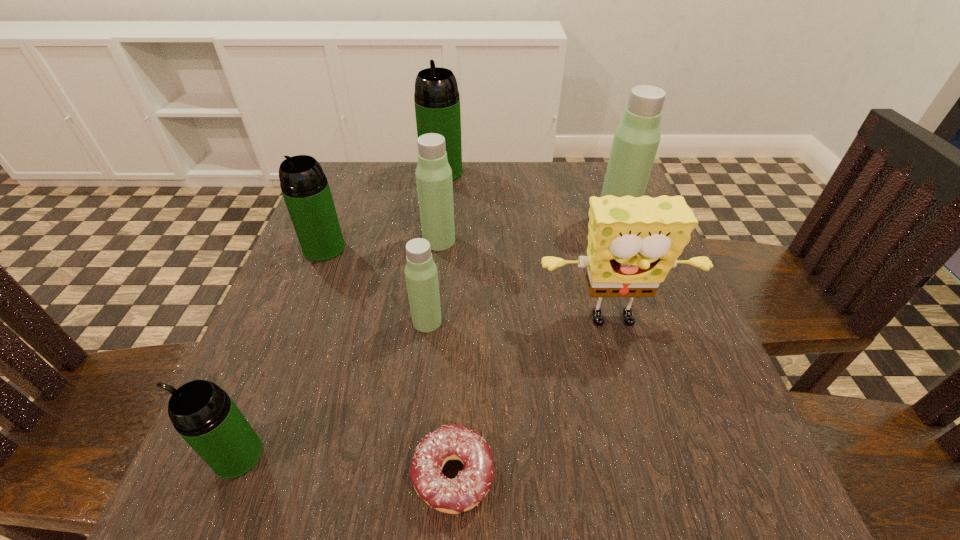
Locate which object is the seventh closest to the nearest green thermos bottle. Please provide its 2D coordinates. Your answer should be formatted as a tuple, i.e. [(x, y)], where the tuple contains the x and y coordinates of a point satisfying the conditions above.

[(637, 137)]

Where is `the fifth closest object to the smallest light thermos bottle`? the fifth closest object to the smallest light thermos bottle is located at coordinates (205, 416).

Find the location of `thermos bottle that is the closest to the second biggest light thermos bottle`. thermos bottle that is the closest to the second biggest light thermos bottle is located at coordinates (304, 186).

Identify which thermos bottle is located as the second nearest to the sponge. Please provide its 2D coordinates. Your answer should be formatted as a tuple, i.e. [(x, y)], where the tuple contains the x and y coordinates of a point satisfying the conditions above.

[(637, 137)]

Image resolution: width=960 pixels, height=540 pixels. What are the coordinates of `green thermos bottle object that ranks as the second closest to the farthest green thermos bottle` in the screenshot? It's located at (205, 416).

Locate which green thermos bottle ranks second in proximity to the nearest thermos bottle. Please provide its 2D coordinates. Your answer should be formatted as a tuple, i.e. [(x, y)], where the tuple contains the x and y coordinates of a point satisfying the conditions above.

[(437, 102)]

Choose which light thermos bottle is the second nearest neighbor to the yellow sponge. Please provide its 2D coordinates. Your answer should be formatted as a tuple, i.e. [(x, y)], where the tuple contains the x and y coordinates of a point satisfying the conditions above.

[(637, 137)]

Locate which light thermos bottle ranks second in proximity to the sponge. Please provide its 2D coordinates. Your answer should be formatted as a tuple, i.e. [(x, y)], where the tuple contains the x and y coordinates of a point satisfying the conditions above.

[(637, 137)]

You are a GUI agent. You are given a task and a screenshot of the screen. Output one action in this format:
    pyautogui.click(x=<x>, y=<y>)
    Task: Click on the free point that satisfies the following two spatial constraints: 1. on the back side of the biggest light thermos bottle; 2. on the right side of the pink doughnut
    Image resolution: width=960 pixels, height=540 pixels.
    Given the screenshot: What is the action you would take?
    pyautogui.click(x=464, y=221)

Find the location of a particular element. The height and width of the screenshot is (540, 960). vacant area in the image that satisfies the following two spatial constraints: 1. on the back side of the smallest light thermos bottle; 2. on the left side of the biggest light thermos bottle is located at coordinates (439, 221).